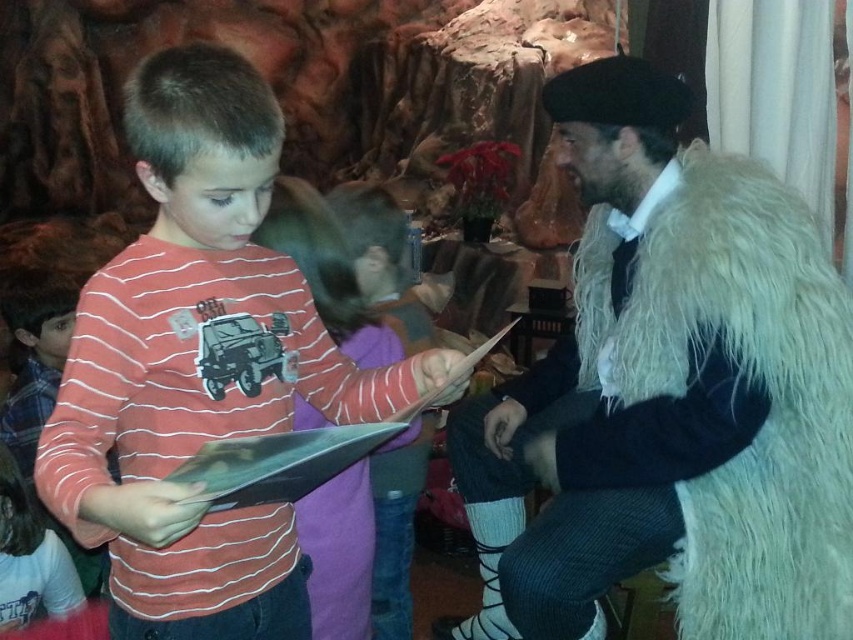
Based on the scene described, can you determine the spatial relationship between the striped cotton shirt at center and the white fluffy fur coat at right? Specifically, which object is positioned to the left?

The striped cotton shirt at center is to the left of the white fluffy fur coat at right.

You are a stagehand measuring the space between the striped cotton shirt at center and the white fluffy fur coat at right. The minimum required distance for a safety barrier is 30 inches. Is the current distance sufficient?

The distance between the striped cotton shirt at center and the white fluffy fur coat at right is 29.78 inches, which is less than the required 30 inches. Therefore, the safety barrier requirement is not met.

You are a costume designer preparing for a play. You need to ensure the striped cotton shirt at center and the white fluffy fur coat at right are placed on a rack. Given their heights, which one should be placed on the lower hanger to avoid blocking the other?

The striped cotton shirt at center is not as tall as the white fluffy fur coat at right, so the striped cotton shirt at center should be placed on the lower hanger to avoid blocking the taller coat.